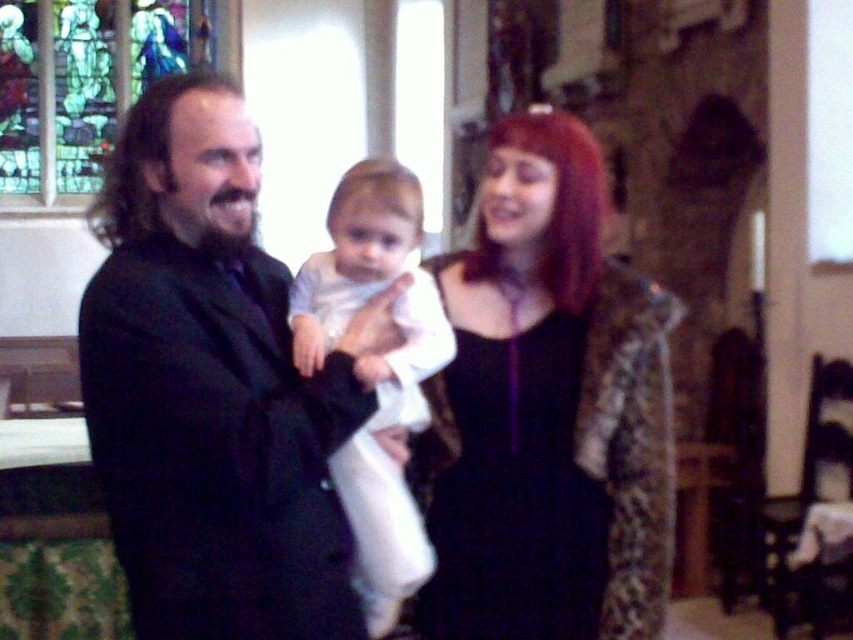
Who is more distant from viewer, (180, 310) or (495, 337)?

Point (495, 337)

Who is taller, black matte suit at center or shiny black dress at center?

Standing taller between the two is black matte suit at center.

The width and height of the screenshot is (853, 640). Describe the element at coordinates (209, 388) in the screenshot. I see `black matte suit at center` at that location.

The width and height of the screenshot is (853, 640). What are the coordinates of `black matte suit at center` in the screenshot? It's located at (209, 388).

Is black matte suit at center below white clothed baby at center?

No, black matte suit at center is not below white clothed baby at center.

Image resolution: width=853 pixels, height=640 pixels. Describe the element at coordinates (209, 388) in the screenshot. I see `black matte suit at center` at that location.

Identify the location of black matte suit at center. (209, 388).

Which of these two, white clothed baby at center or stained glass window at upper left, stands taller?

stained glass window at upper left

Which is in front, point (393, 428) or point (21, 83)?

Point (393, 428)

Describe the element at coordinates (376, 371) in the screenshot. Image resolution: width=853 pixels, height=640 pixels. I see `white clothed baby at center` at that location.

This screenshot has width=853, height=640. Find the location of `white clothed baby at center`. white clothed baby at center is located at coordinates (x=376, y=371).